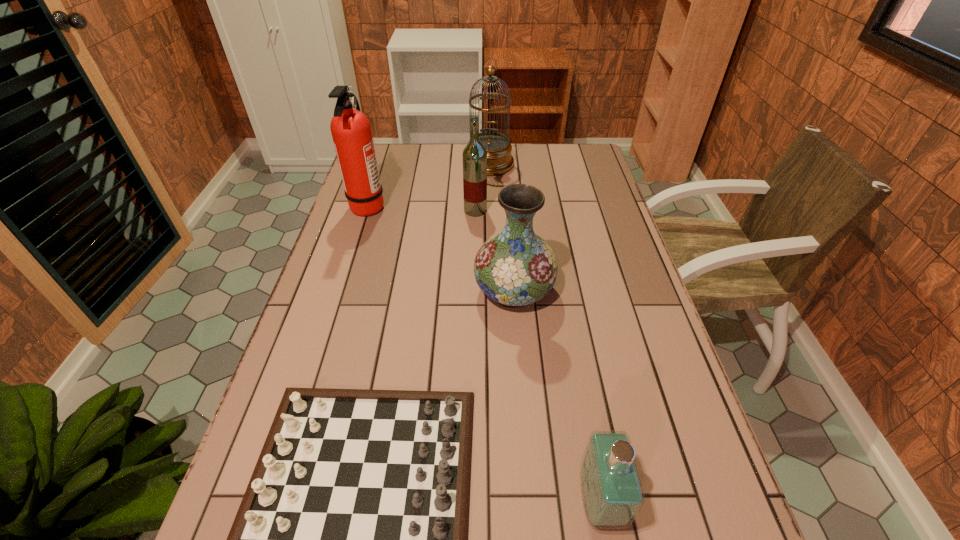
The width and height of the screenshot is (960, 540). I want to click on vacant area situated 0.380m on the front label of the fifth tallest object, so click(372, 501).

Where is `vacant space situated on the front label of the fifth tallest object`? The width and height of the screenshot is (960, 540). vacant space situated on the front label of the fifth tallest object is located at coordinates (366, 501).

At what (x,y) coordinates should I click in order to perform the action: click on object present at the far edge. Please return your answer as a coordinate pair (x, y). The image size is (960, 540). Looking at the image, I should click on (499, 159).

At what (x,y) coordinates should I click in order to perform the action: click on object at the left edge. Please return your answer as a coordinate pair (x, y). Looking at the image, I should click on (351, 131).

In the image, there is a desktop. Where is `free space at the far edge`? free space at the far edge is located at coordinates (454, 165).

Where is `vacant space at the left edge of the desktop`? vacant space at the left edge of the desktop is located at coordinates (341, 280).

The image size is (960, 540). What are the coordinates of `free space at the right edge` in the screenshot? It's located at (625, 231).

Where is `vacant space at the far left corner of the desktop`? Image resolution: width=960 pixels, height=540 pixels. vacant space at the far left corner of the desktop is located at coordinates (394, 174).

Identify the location of vacant area that lies between the vase and the perfume. (557, 396).

Where is `free space between the vase and the second shortest object`? The image size is (960, 540). free space between the vase and the second shortest object is located at coordinates click(x=557, y=396).